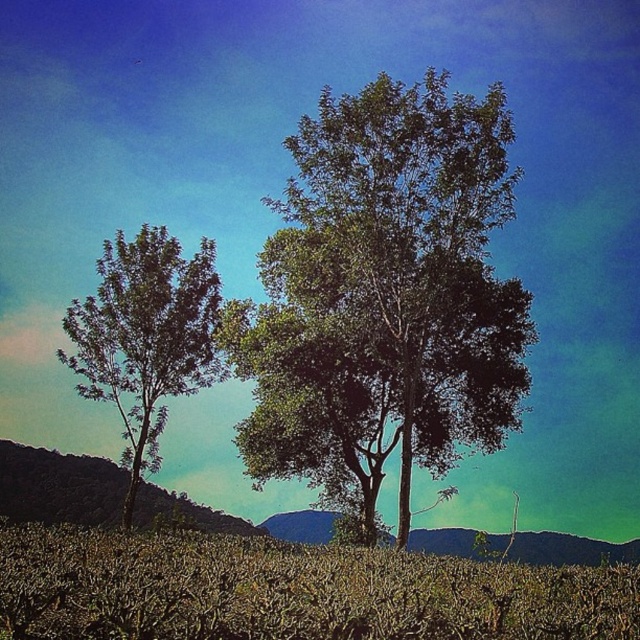
Measure the distance between point (364, 106) and camera.

Point (364, 106) is 21.76 meters away from camera.

Which is above, green leafy tree at center or brown dry grass at lower center?

green leafy tree at center

Between point (378, 104) and point (198, 592), which one is positioned in front?

Point (198, 592) is more forward.

Image resolution: width=640 pixels, height=640 pixels. In order to click on green leafy tree at center in this screenshot , I will do `click(385, 298)`.

Which is above, green leafy tree at center or dark green foliage at left?

green leafy tree at center

You are a GUI agent. You are given a task and a screenshot of the screen. Output one action in this format:
    pyautogui.click(x=<x>, y=<y>)
    Task: Click on the green leafy tree at center
    Image resolution: width=640 pixels, height=640 pixels.
    Given the screenshot: What is the action you would take?
    pyautogui.click(x=385, y=298)

Is brown dry grass at lower center in front of green leafy tree at left?

Yes, it is.

Is point (346, 579) behind point (124, 448)?

No, (346, 579) is closer to viewer.

Between point (106, 556) and point (168, 268), which one is positioned in front?

Point (106, 556) is in front.

Image resolution: width=640 pixels, height=640 pixels. I want to click on brown dry grass at lower center, so click(x=291, y=592).